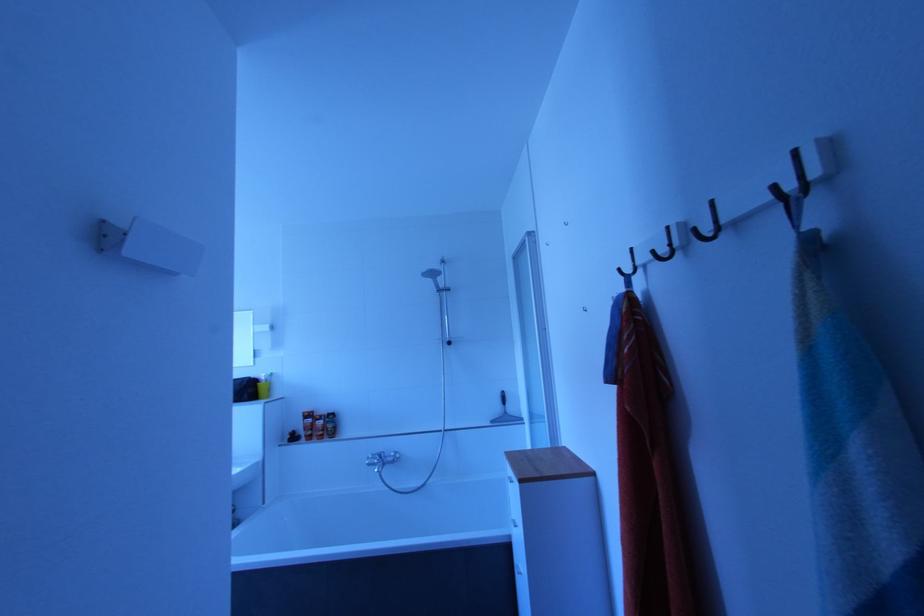
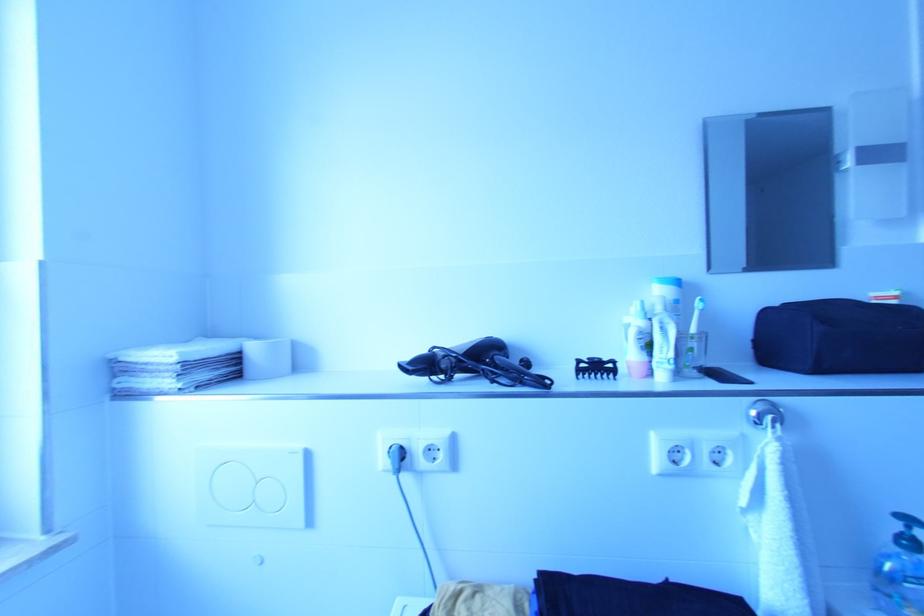
What movement of the cameraman would produce the second image?

The cameraman moved toward left, forward.